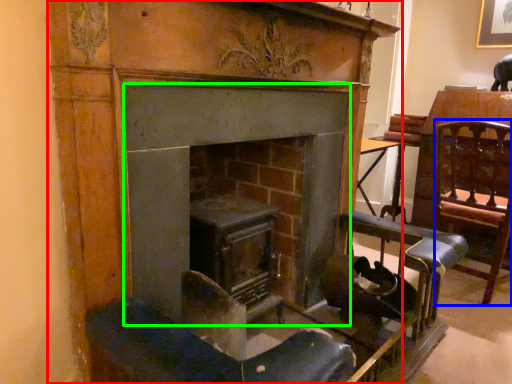
Question: Which object is positioned closest to fireplace (highlighted by a red box)? Select from swivel chair (highlighted by a blue box) and fireplace (highlighted by a green box).

Choices:
 (A) swivel chair
 (B) fireplace

Answer: (B)